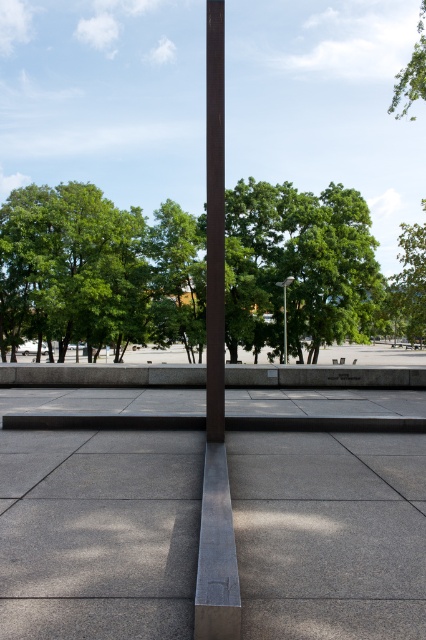
You are a city planner designing a new public space. You need to place a new sculpture that requires a base 1.2 meters wide. Given the satin brown pole at center and the wooden park bench at center, which object can accommodate the sculpture base without overlapping?

The wooden park bench at center has a greater width than the satin brown pole at center, so the sculpture base can be placed on the wooden park bench at center as it provides sufficient width.

You are standing in the urban setting shown in the image. You see two points marked on the ground. Which point, point (x=222, y=410) or point (x=336, y=358), is closer to you?

Point (x=222, y=410) is closer to you than point (x=336, y=358).